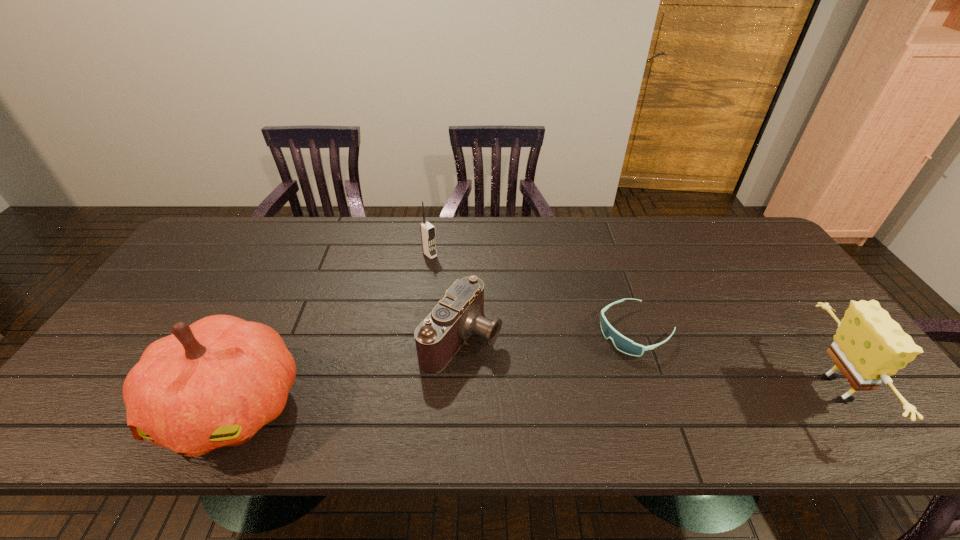
Find the location of a particular element. vacant region located on the front-facing side of the goggles is located at coordinates (591, 356).

You are a GUI agent. You are given a task and a screenshot of the screen. Output one action in this format:
    pyautogui.click(x=<x>, y=<y>)
    Task: Click on the free region located on the front-facing side of the goggles
    This screenshot has height=540, width=960.
    Given the screenshot: What is the action you would take?
    pyautogui.click(x=519, y=397)

Identify the location of vacant space situated on the front-facing side of the camera. (540, 375).

You are a GUI agent. You are given a task and a screenshot of the screen. Output one action in this format:
    pyautogui.click(x=<x>, y=<y>)
    Task: Click on the free space located 0.210m on the front-facing side of the camera
    
    Given the screenshot: What is the action you would take?
    pyautogui.click(x=576, y=392)

The height and width of the screenshot is (540, 960). In order to click on blank area located on the front-facing side of the camera in this screenshot , I will do `click(521, 367)`.

The width and height of the screenshot is (960, 540). In order to click on vacant space located on the front-facing side of the farthest object in this screenshot , I will do coord(504,315).

In order to click on vacant region located on the front-facing side of the farthest object in this screenshot , I will do `click(450, 271)`.

This screenshot has height=540, width=960. Find the location of `free space located 0.390m on the front-facing side of the farthest object`. free space located 0.390m on the front-facing side of the farthest object is located at coordinates (522, 329).

Locate an element on the screen. object located at the far edge is located at coordinates (427, 230).

This screenshot has height=540, width=960. I want to click on pumpkin that is at the near edge, so click(214, 383).